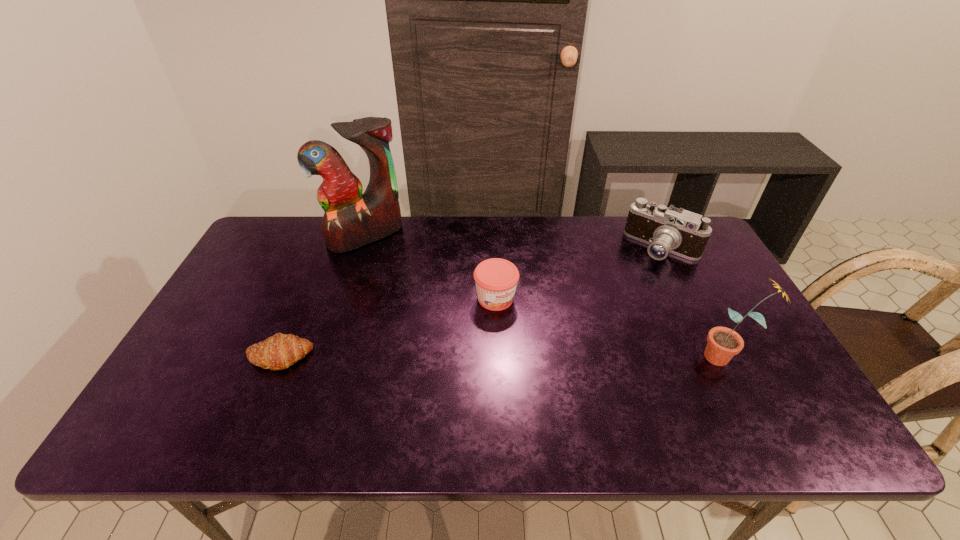
Where is `vacant space located 0.370m at the face of the parrot`? The width and height of the screenshot is (960, 540). vacant space located 0.370m at the face of the parrot is located at coordinates (437, 324).

Locate an element on the screen. The image size is (960, 540). vacant area situated at the face of the parrot is located at coordinates (396, 271).

You are a GUI agent. You are given a task and a screenshot of the screen. Output one action in this format:
    pyautogui.click(x=<x>, y=<y>)
    Task: Click on the vacant space located at the face of the parrot
    This screenshot has width=960, height=540.
    Given the screenshot: What is the action you would take?
    pyautogui.click(x=417, y=298)

Identify the location of vacant space positioned 0.180m at the lens of the third shortest object. The height and width of the screenshot is (540, 960). (614, 292).

The width and height of the screenshot is (960, 540). I want to click on vacant area located 0.310m at the lens of the third shortest object, so click(589, 315).

Where is `vacant point located 0.340m at the lens of the third shortest object`? vacant point located 0.340m at the lens of the third shortest object is located at coordinates (583, 321).

This screenshot has height=540, width=960. In order to click on vacant area located 0.340m on the front label of the jam in this screenshot , I will do `click(589, 406)`.

The height and width of the screenshot is (540, 960). What are the coordinates of `vacant region located on the front label of the jam` in the screenshot? It's located at (575, 390).

Find the location of a particular element. The image size is (960, 540). vacant space situated 0.300m on the front label of the jam is located at coordinates (578, 393).

Image resolution: width=960 pixels, height=540 pixels. Find the location of `parrot present at the far edge`. parrot present at the far edge is located at coordinates click(351, 220).